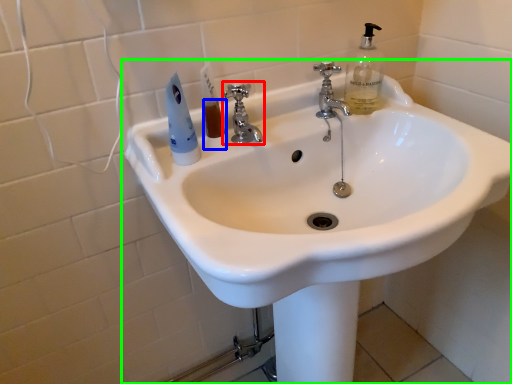
Question: Considering the real-world distances, which object is farthest from tap (highlighted by a red box)? liquid (highlighted by a blue box) or sink (highlighted by a green box)?

Choices:
 (A) liquid
 (B) sink

Answer: (B)